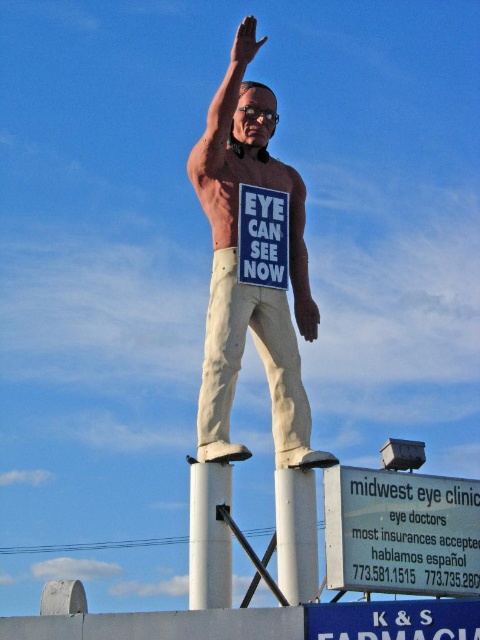
Question: Which of the following is the closest to the observer?

Choices:
 (A) (272, 387)
 (B) (302, 602)

Answer: (B)

Question: Which of the following is the closest to the observer?

Choices:
 (A) (288, 262)
 (B) (205, 387)
 (C) (285, 582)

Answer: (C)

Question: Can you confirm if white plastic sign at lower right is positioned to the right of white painted metal pole at center?

Choices:
 (A) no
 (B) yes

Answer: (B)

Question: From the image, what is the correct spatial relationship of matte orange shirt at center in relation to white painted metal pole at center?

Choices:
 (A) right
 (B) left

Answer: (A)

Question: Can you confirm if white painted metal pole at center is wider than white matte signboard at center?

Choices:
 (A) no
 (B) yes

Answer: (B)

Question: Which of the following is the farthest from the observer?

Choices:
 (A) (205, 492)
 (B) (309, 582)
 (C) (429, 548)

Answer: (A)